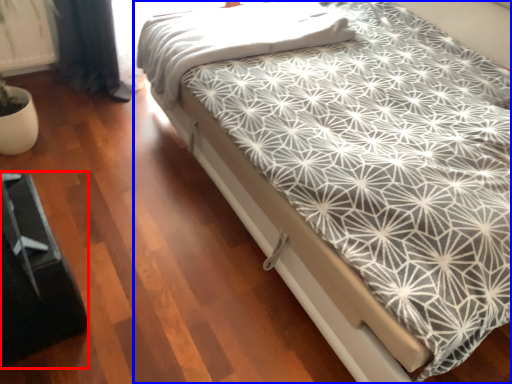
Question: Which object is further to the camera taking this photo, bed frame (highlighted by a red box) or bed (highlighted by a blue box)?

Choices:
 (A) bed frame
 (B) bed

Answer: (A)